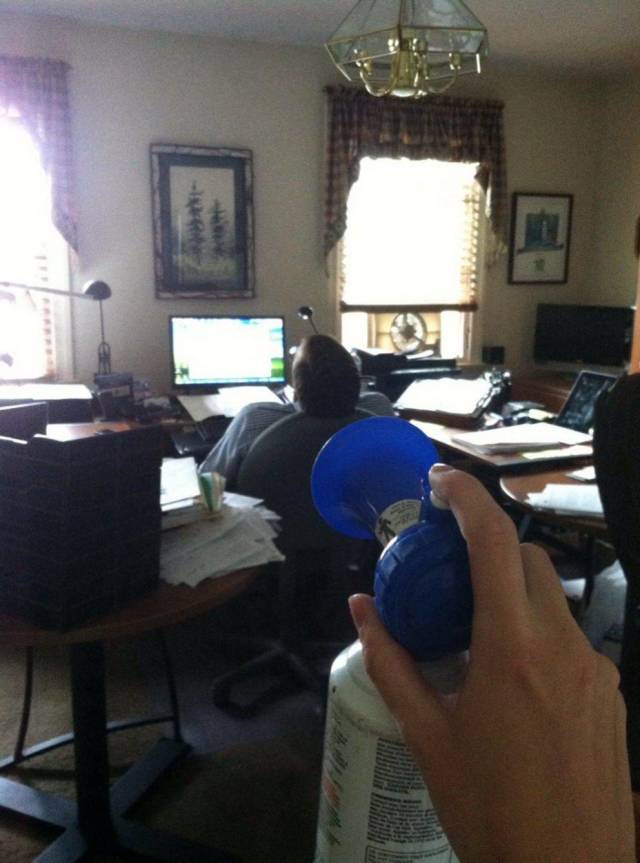
Locate an element on the screen. This screenshot has width=640, height=863. window fans is located at coordinates (10, 342), (402, 335).